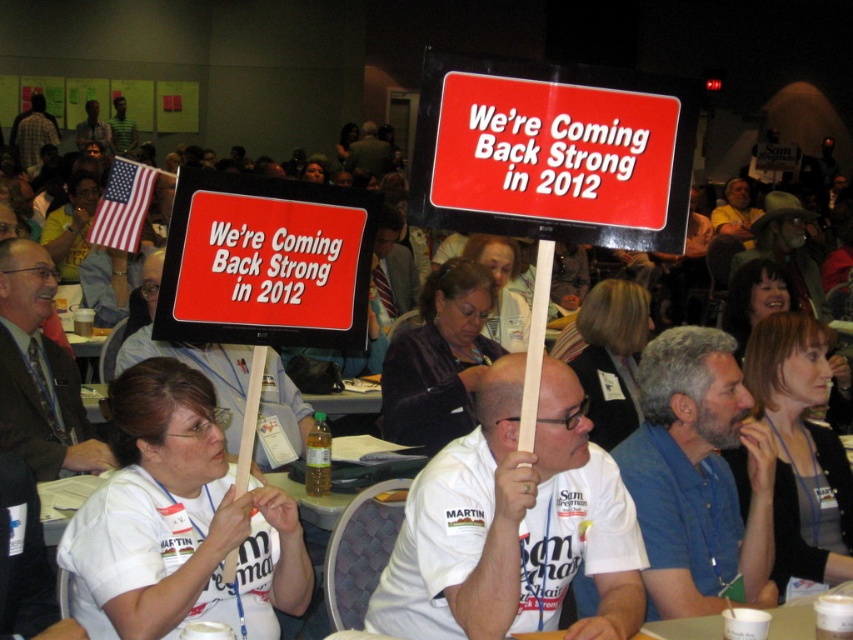
Question: Which point is farther to the camera?

Choices:
 (A) (676, 429)
 (B) (590, 492)

Answer: (A)

Question: Which of the following is the closest to the observer?

Choices:
 (A) (74, 365)
 (B) (706, 572)

Answer: (B)

Question: Can you confirm if white cotton shirt at center is wider than dark brown suit at center?

Choices:
 (A) yes
 (B) no

Answer: (A)

Question: Can you confirm if white cotton shirt at center is positioned to the left of dark brown suit at center?

Choices:
 (A) yes
 (B) no

Answer: (B)

Question: Estimate the real-world distances between objects in this image. Which object is closer to the blue cotton shirt at center?

Choices:
 (A) dark brown suit at center
 (B) white cotton shirt at center

Answer: (B)

Question: Is white cotton shirt at center thinner than blue cotton shirt at center?

Choices:
 (A) no
 (B) yes

Answer: (A)